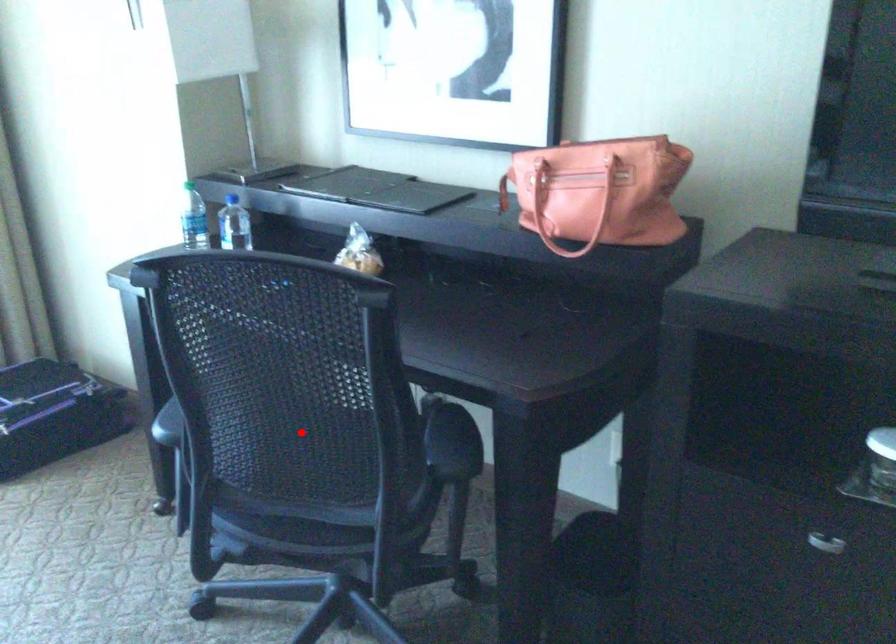
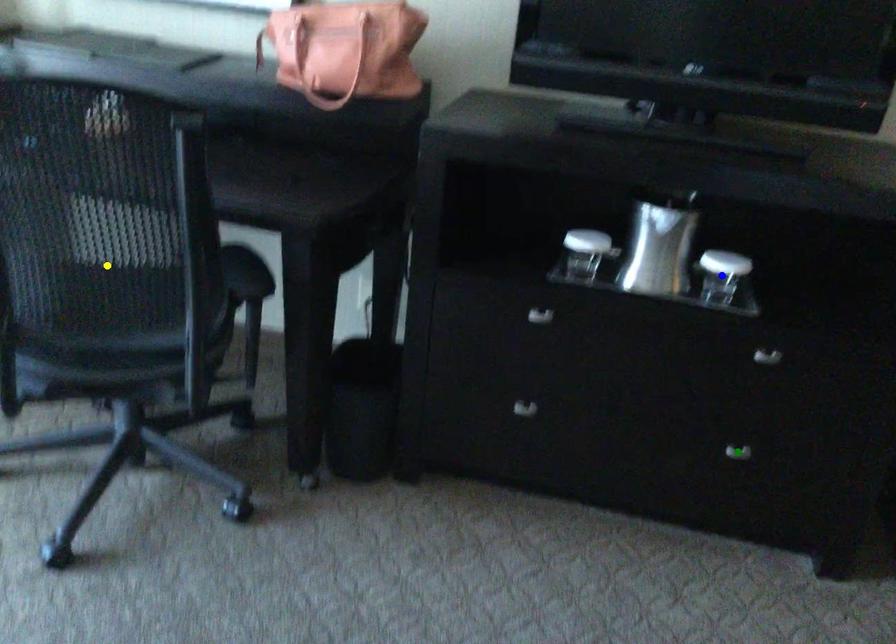
Question: I am providing you with two images of the same scene from different viewpoints. A red point is marked on the first image. You are given multiple points on the second image. In image 2, which mark is for the same physical point as the one in image 1?

Choices:
 (A) blue point
 (B) green point
 (C) yellow point

Answer: (C)